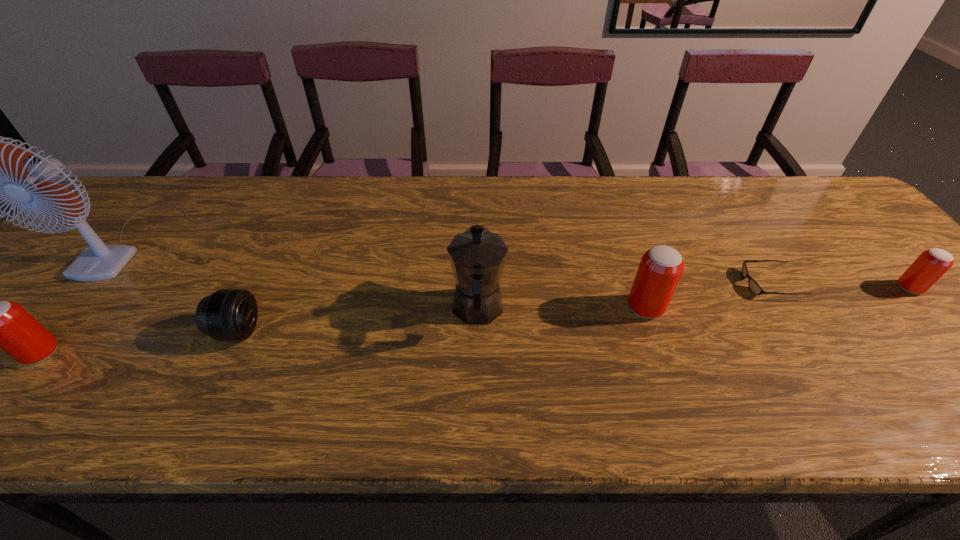
At what (x,y) coordinates should I click in order to perform the action: click on free spot between the shortest object and the rightmost beer can. Please return your answer as a coordinate pair (x, y). The image size is (960, 540). Looking at the image, I should click on (839, 286).

The image size is (960, 540). I want to click on free space that is in between the telephoto lens and the coffeepot, so click(358, 321).

This screenshot has width=960, height=540. I want to click on empty location between the rightmost beer can and the sixth object from left to right, so click(839, 286).

Locate an element on the screen. The width and height of the screenshot is (960, 540). free space between the sixth shortest object and the tallest object is located at coordinates (311, 275).

Image resolution: width=960 pixels, height=540 pixels. What are the coordinates of `free space between the tallest beer can and the telephoto lens` in the screenshot? It's located at (442, 320).

Locate an element on the screen. This screenshot has height=540, width=960. free space between the nearest beer can and the fan is located at coordinates (93, 297).

Locate which object is the closest to the shortest object. Please provide its 2D coordinates. Your answer should be formatted as a tuple, i.e. [(x, y)], where the tuple contains the x and y coordinates of a point satisfying the conditions above.

[(660, 269)]

This screenshot has height=540, width=960. Find the location of `the closest object to the telephoto lens`. the closest object to the telephoto lens is located at coordinates (97, 262).

Choose which beer can is the nearest neighbor to the sixth object from left to right. Please provide its 2D coordinates. Your answer should be formatted as a tuple, i.e. [(x, y)], where the tuple contains the x and y coordinates of a point satisfying the conditions above.

[(660, 269)]

Choose which beer can is the nearest neighbor to the nearest beer can. Please provide its 2D coordinates. Your answer should be formatted as a tuple, i.e. [(x, y)], where the tuple contains the x and y coordinates of a point satisfying the conditions above.

[(660, 269)]